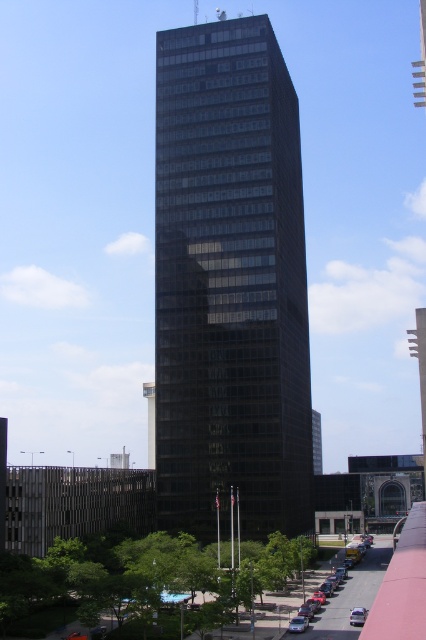
Based on the photo, you are a city planner evaluating the urban space. The black glass building at center and the silver metallic sedan at lower right are both visible from the main road. Which object occupies a greater area in the scene?

The black glass building at center is larger in size than the silver metallic sedan at lower right, so it occupies a greater area in the scene.

You are standing on the sidewalk near the black glass building at center. You want to take a photo of the building with your smartphone. Considering the distance, will you be able to capture the entire building in one frame without zooming?

The black glass building at center is 96.58 meters away from the viewer. Since smartphones typically have a wide enough angle to capture distant tall structures at that distance, you should be able to fit the entire building in one frame without zooming.

You are standing at the base of the skyscraper and want to walk to a specific point marked as point (368, 573). Given that the distance between you and this point is 115.22 meters, can you estimate how far you need to walk to reach it?

The distance between you and point (368, 573) is 115.22 meters, so you need to walk approximately 115.22 meters to reach it.